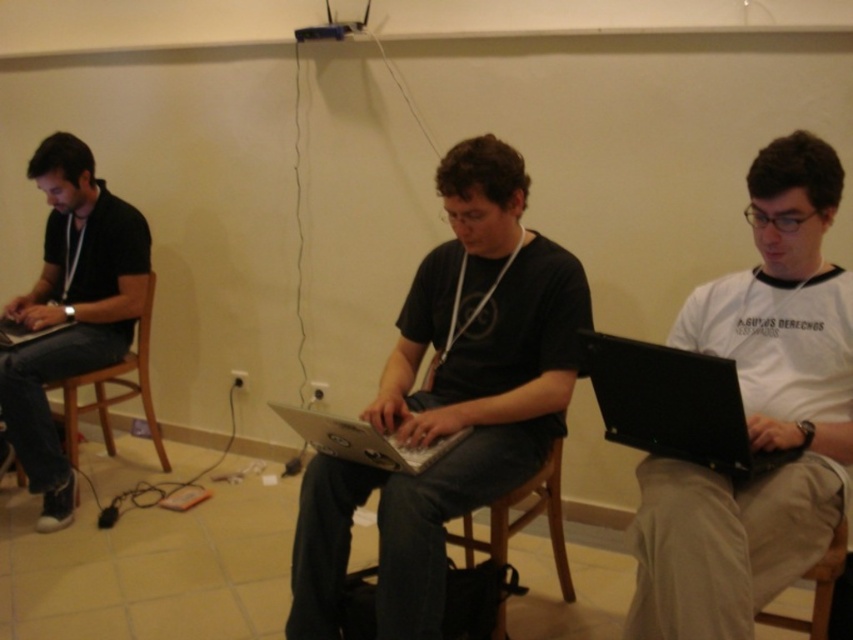
You are trying to locate the silver metallic laptop at center. Based on the scene description, where would you find it relative to the matte black laptop at left?

The silver metallic laptop at center is positioned under the matte black laptop at left.